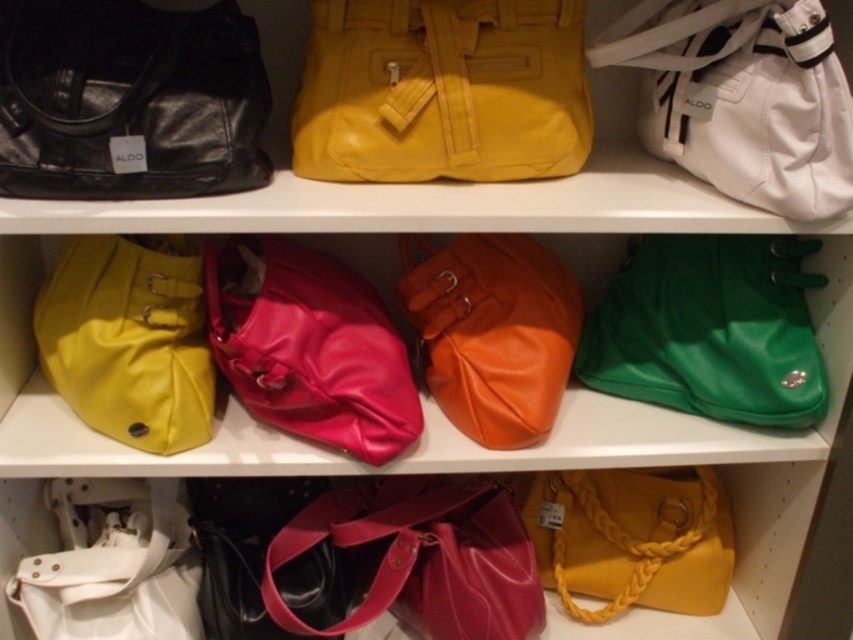
Does white synthetic tote at upper right have a lesser width compared to shiny pink purse at center?

Yes, white synthetic tote at upper right is thinner than shiny pink purse at center.

Can you confirm if white synthetic tote at upper right is positioned to the right of shiny pink purse at center?

Yes, white synthetic tote at upper right is to the right of shiny pink purse at center.

This screenshot has height=640, width=853. Find the location of `white synthetic tote at upper right`. white synthetic tote at upper right is located at coordinates (741, 97).

Is point (527, 323) positioned in front of point (566, 484)?

Yes, point (527, 323) is in front of point (566, 484).

Can you confirm if orange leather handbag at center is shorter than yellow woven handbag at lower right?

Incorrect, orange leather handbag at center's height does not fall short of yellow woven handbag at lower right's.

You are a GUI agent. You are given a task and a screenshot of the screen. Output one action in this format:
    pyautogui.click(x=<x>, y=<y>)
    Task: Click on the orange leather handbag at center
    This screenshot has width=853, height=640.
    Given the screenshot: What is the action you would take?
    pyautogui.click(x=492, y=333)

Identify the location of orange leather handbag at center. (492, 333).

Consider the image. Is green leather handbag at upper right further to the viewer compared to white leather handbag at lower left?

That is False.

Can you confirm if green leather handbag at upper right is taller than white leather handbag at lower left?

Correct, green leather handbag at upper right is much taller as white leather handbag at lower left.

At what (x,y) coordinates should I click in order to perform the action: click on green leather handbag at upper right. Please return your answer as a coordinate pair (x, y). The height and width of the screenshot is (640, 853). Looking at the image, I should click on (711, 330).